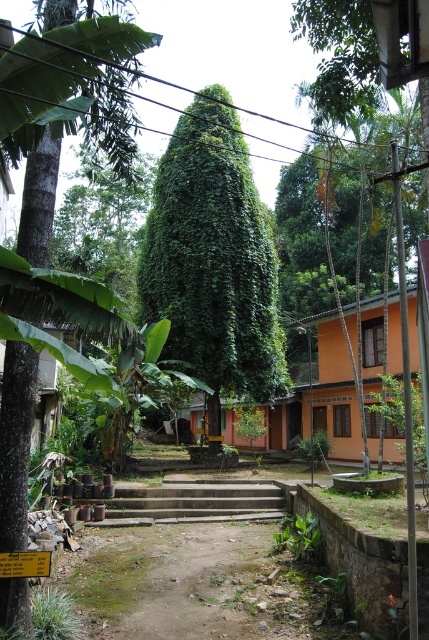
You are standing at the center of the image and want to locate the green leafy tree at center. According to the coordinates provided, in which direction should you look to find it?

The green leafy tree at center is located at coordinates point (213, 260), which means it is slightly to the left and just below the exact center of the image.

You are standing in the center of the image and want to walk towards the green leafy tree at left. Which direction should you face to head directly towards it?

To head directly towards the green leafy tree at left, you should face towards the left since the green leafy tree at left is located at the left side of the image.

Looking at this image, you are standing at the base of the green leafy tree at center and want to walk to the concrete stairs at center. Which direction should you walk to reach the stairs?

The concrete stairs at center are located to the right of the green leafy tree at center, so you should walk to the right to reach them.